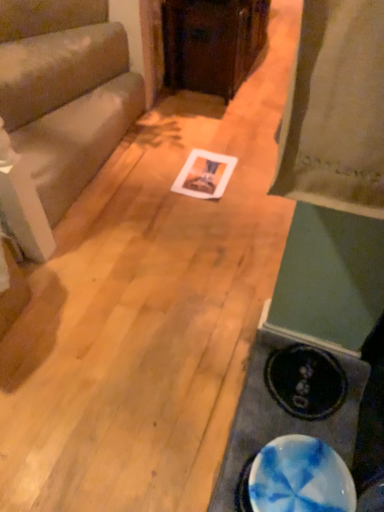
You are a GUI agent. You are given a task and a screenshot of the screen. Output one action in this format:
    pyautogui.click(x=<x>, y=<y>)
    Task: Click on the free point below blue marble table at lower right (from a real-world perspective)
    
    Given the screenshot: What is the action you would take?
    pyautogui.click(x=301, y=410)